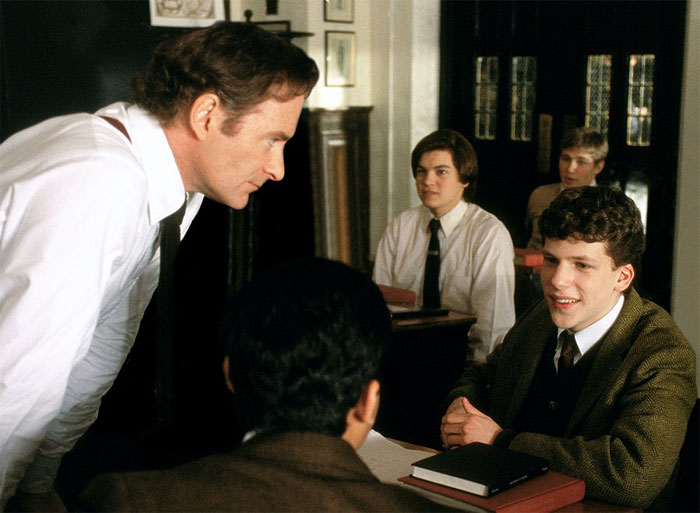
You are a GUI agent. You are given a task and a screenshot of the screen. Output one action in this format:
    pyautogui.click(x=<x>, y=<y>)
    Task: Click on the picture hanging on wall
    The height and width of the screenshot is (513, 700).
    Given the screenshot: What is the action you would take?
    pyautogui.click(x=344, y=63)